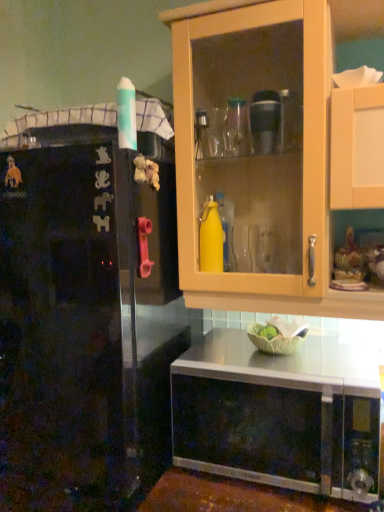
Locate an element on the screen. This screenshot has width=384, height=512. free location above stainless steel microwave at lower center (from a real-world perspective) is located at coordinates (308, 362).